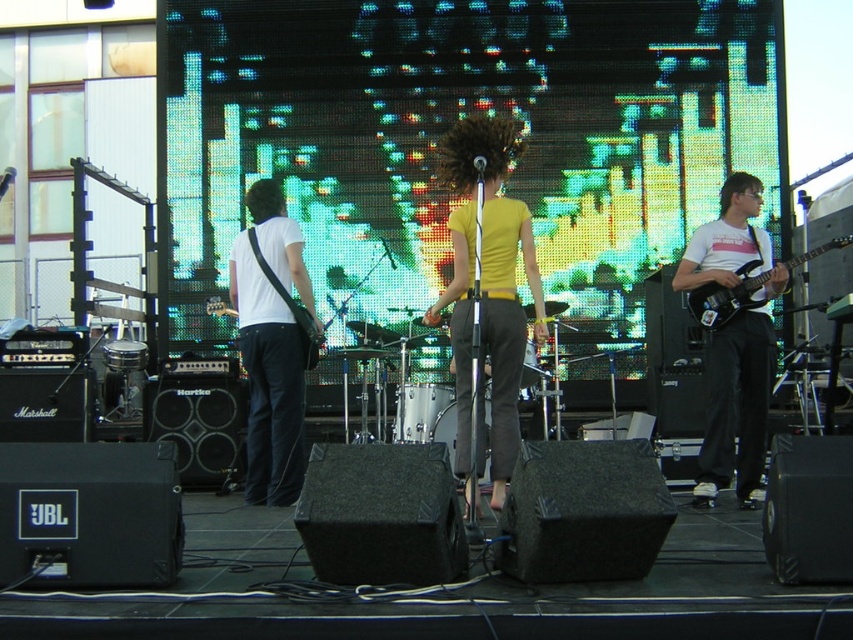
Between white matte shirt at left and matte black guitar at left, which one appears on the right side from the viewer's perspective?

From the viewer's perspective, white matte shirt at left appears more on the right side.

Between white matte shirt at left and matte black guitar at left, which one has less height?

matte black guitar at left

This screenshot has height=640, width=853. Describe the element at coordinates (271, 346) in the screenshot. I see `white matte shirt at left` at that location.

Where is `white matte shirt at left`? The width and height of the screenshot is (853, 640). white matte shirt at left is located at coordinates (271, 346).

Between white matte shirt at left and matte black electric guitar at right, which one appears on the left side from the viewer's perspective?

white matte shirt at left

Does white matte shirt at left have a lesser width compared to matte black electric guitar at right?

Yes.

Is point (277, 371) more distant than point (712, 321)?

Yes, it is.

The width and height of the screenshot is (853, 640). Find the location of `white matte shirt at left`. white matte shirt at left is located at coordinates (271, 346).

Who is taller, yellow matte shirt at center or white matte shirt at left?

Standing taller between the two is yellow matte shirt at center.

Does point (532, 292) come in front of point (257, 305)?

Yes, point (532, 292) is in front of point (257, 305).

This screenshot has width=853, height=640. What do you see at coordinates (488, 288) in the screenshot?
I see `yellow matte shirt at center` at bounding box center [488, 288].

The height and width of the screenshot is (640, 853). I want to click on yellow matte shirt at center, so [x=488, y=288].